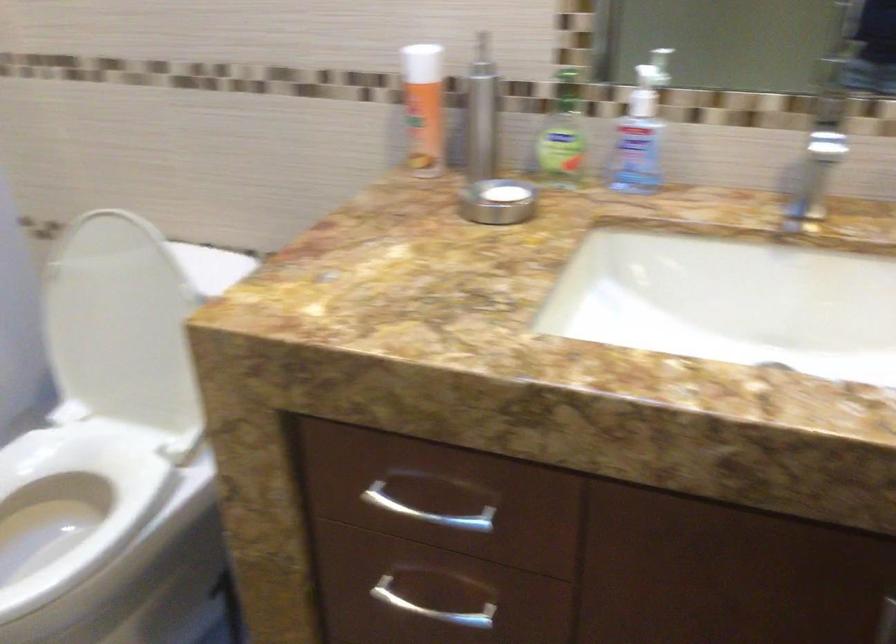
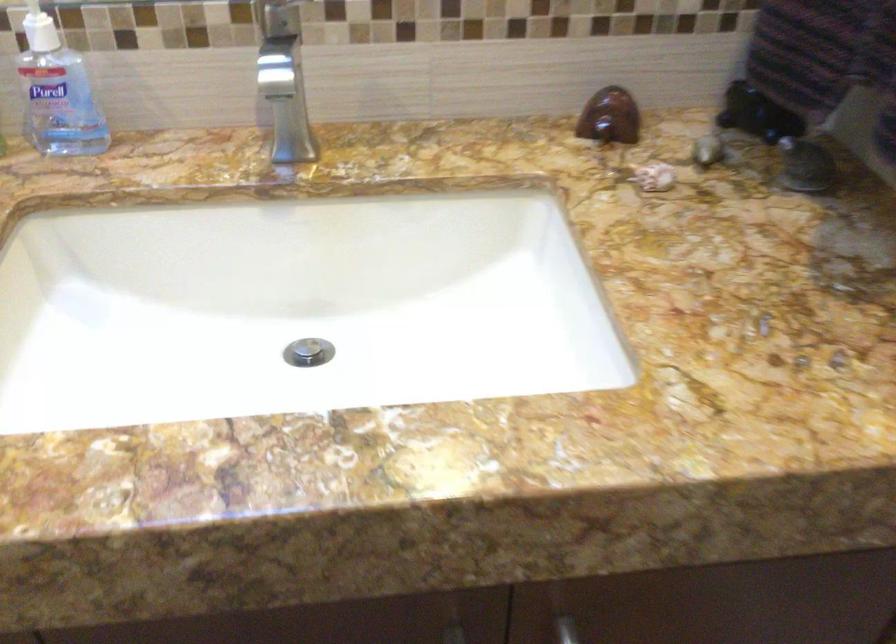
Where in the second image is the point corresponding to the point at 822,102 from the first image?

(268, 14)